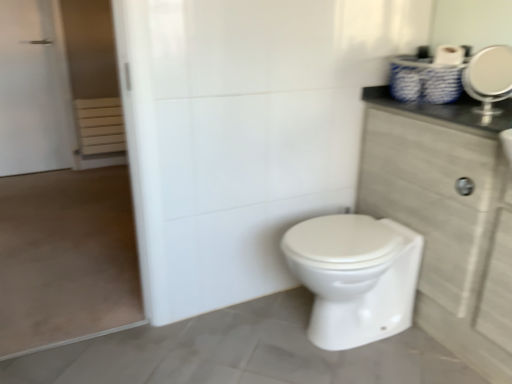
Question: Are white glossy toilet at center and wooden cabinet at right located far from each other?

Choices:
 (A) yes
 (B) no

Answer: (B)

Question: Is white glossy toilet at center taller than wooden cabinet at right?

Choices:
 (A) yes
 (B) no

Answer: (B)

Question: Does white glossy toilet at center have a greater width compared to wooden cabinet at right?

Choices:
 (A) yes
 (B) no

Answer: (A)

Question: Does white glossy toilet at center lie in front of wooden cabinet at right?

Choices:
 (A) yes
 (B) no

Answer: (B)

Question: From a real-world perspective, is white glossy toilet at center under wooden cabinet at right?

Choices:
 (A) no
 (B) yes

Answer: (B)

Question: Considering the relative positions of white glossy toilet at center and wooden cabinet at right in the image provided, is white glossy toilet at center to the right of wooden cabinet at right from the viewer's perspective?

Choices:
 (A) no
 (B) yes

Answer: (A)

Question: From the image's perspective, is silver metallic mirror at upper right above white matte screen door at left?

Choices:
 (A) no
 (B) yes

Answer: (B)

Question: Would you say silver metallic mirror at upper right contains white matte screen door at left?

Choices:
 (A) no
 (B) yes

Answer: (A)

Question: Is silver metallic mirror at upper right closer to the viewer compared to white matte screen door at left?

Choices:
 (A) yes
 (B) no

Answer: (B)

Question: From a real-world perspective, is silver metallic mirror at upper right on white matte screen door at left?

Choices:
 (A) no
 (B) yes

Answer: (B)

Question: Is white matte screen door at left at the back of silver metallic mirror at upper right?

Choices:
 (A) yes
 (B) no

Answer: (B)

Question: Could you tell me if silver metallic mirror at upper right is facing white matte screen door at left?

Choices:
 (A) no
 (B) yes

Answer: (A)

Question: Are white glossy toilet at center and white matte screen door at left far apart?

Choices:
 (A) no
 (B) yes

Answer: (B)